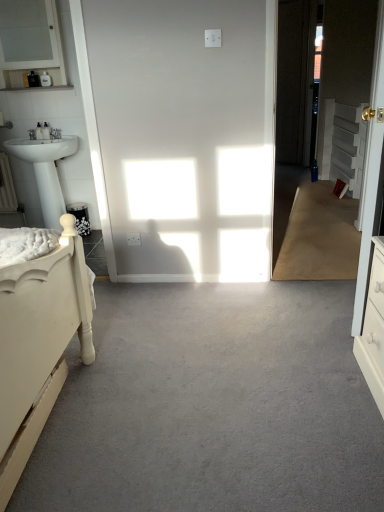
The width and height of the screenshot is (384, 512). In order to click on vacant region to the left of white glossy door at right in this screenshot , I will do `click(343, 238)`.